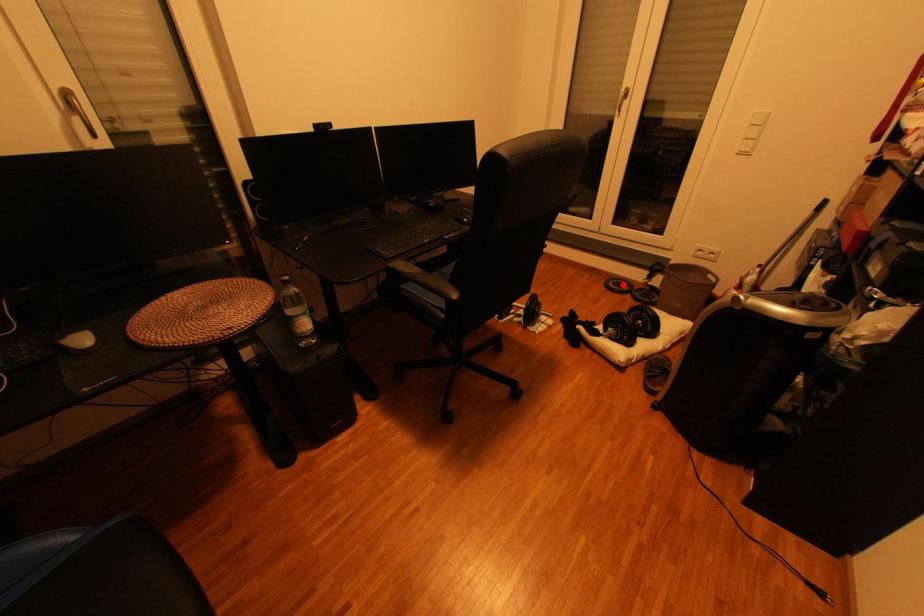
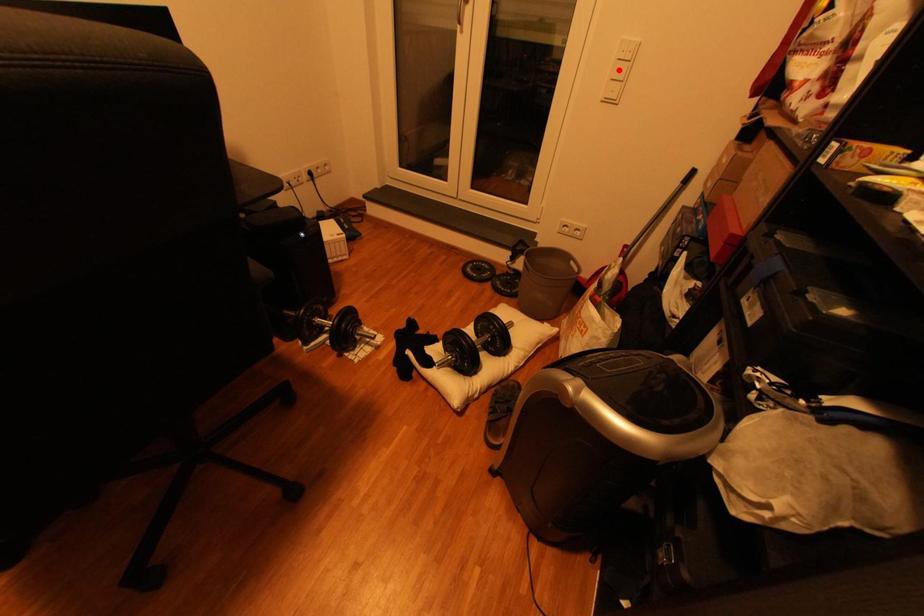
I am providing you with two images of the same scene from different viewpoints. A red point is marked on the first image and another point is marked on the second image. Is the marked point in image1 the same physical position as the marked point in image2?

No